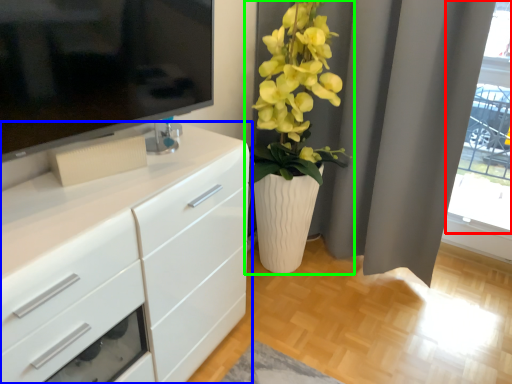
Question: Which object is positioned closest to glass door (highlighted by a red box)? Select from chest of drawers (highlighted by a blue box) and houseplant (highlighted by a green box).

Choices:
 (A) chest of drawers
 (B) houseplant

Answer: (B)